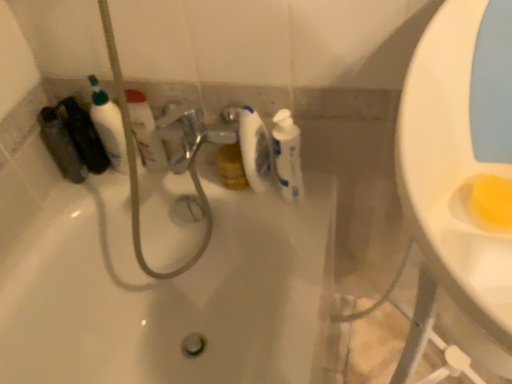
Where is `empty space that is in between white glossy bottle at upper left, which ranks as the second cleaning product in right-to-left order, and translucent plastic mouthwash at left`? empty space that is in between white glossy bottle at upper left, which ranks as the second cleaning product in right-to-left order, and translucent plastic mouthwash at left is located at coordinates (115, 167).